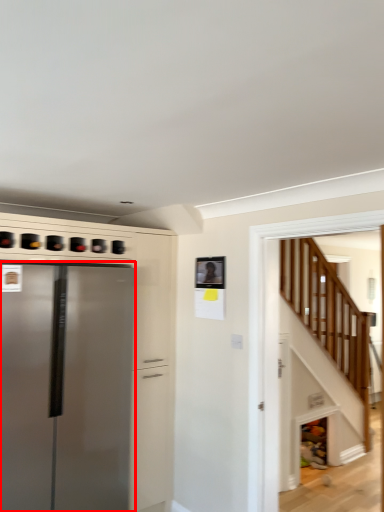
Question: From the image's perspective, what is the correct spatial positioning of refrigerator (annotated by the red box) in reference to stairwell?

Choices:
 (A) above
 (B) below

Answer: (B)